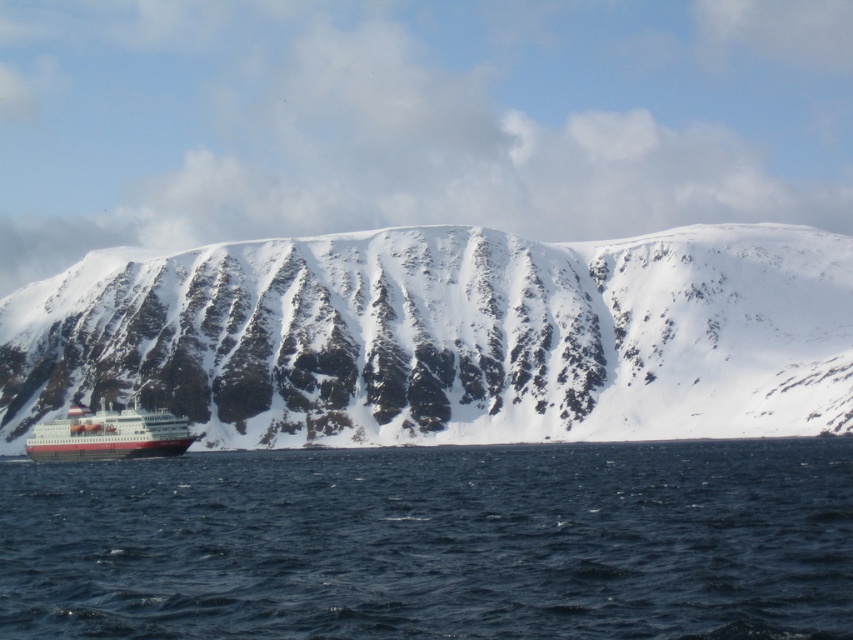
Consider the image. You are a passenger on the red matte ship at lower left and want to see the blue water at lower center. In which direction should you look from your current position?

You should look downward from the red matte ship at lower left because the blue water at lower center is located below it.

You are an observer standing on the shore of the ocean in the image. You see the snowy rock mountain at lower left and the red matte ship at lower left. Which object appears wider from your vantage point?

The snowy rock mountain at lower left appears wider than the red matte ship at lower left because its width is larger than the ship.